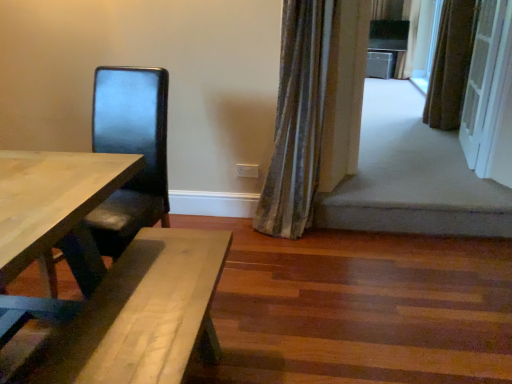
Question: Is striped fabric curtain at upper right, placed as the third curtain when sorted from bottom to top, far from white textured screen door at upper right?

Choices:
 (A) no
 (B) yes

Answer: (B)

Question: Is the depth of striped fabric curtain at upper right, which appears as the first curtain when viewed from the top, greater than that of white textured screen door at upper right?

Choices:
 (A) yes
 (B) no

Answer: (A)

Question: Does striped fabric curtain at upper right, the 3th curtain from the left, have a lesser height compared to white textured screen door at upper right?

Choices:
 (A) no
 (B) yes

Answer: (A)

Question: Considering the relative positions of striped fabric curtain at upper right, the 3th curtain when ordered from front to back, and white textured screen door at upper right in the image provided, is striped fabric curtain at upper right, the 3th curtain when ordered from front to back, to the left of white textured screen door at upper right from the viewer's perspective?

Choices:
 (A) no
 (B) yes

Answer: (A)

Question: Considering the relative sizes of striped fabric curtain at upper right, the 3th curtain from the left, and white textured screen door at upper right in the image provided, is striped fabric curtain at upper right, the 3th curtain from the left, bigger than white textured screen door at upper right?

Choices:
 (A) yes
 (B) no

Answer: (B)

Question: Visually, is white textured screen door at upper right positioned to the left or to the right of matte black chair at left?

Choices:
 (A) left
 (B) right

Answer: (B)

Question: From their relative heights in the image, would you say white textured screen door at upper right is taller or shorter than matte black chair at left?

Choices:
 (A) tall
 (B) short

Answer: (A)

Question: Considering the positions of point (459, 139) and point (92, 235), is point (459, 139) closer or farther from the camera than point (92, 235)?

Choices:
 (A) closer
 (B) farther

Answer: (B)

Question: Is white textured screen door at upper right in front of or behind matte black chair at left in the image?

Choices:
 (A) front
 (B) behind

Answer: (B)

Question: Looking at their shapes, would you say white textured screen door at upper right is wider or thinner than velvet-like curtain at upper right, which ranks as the third curtain in top-to-bottom order?

Choices:
 (A) wide
 (B) thin

Answer: (B)

Question: From a real-world perspective, is white textured screen door at upper right above or below velvet-like curtain at upper right, the third curtain viewed from the back?

Choices:
 (A) below
 (B) above

Answer: (B)

Question: From their relative heights in the image, would you say white textured screen door at upper right is taller or shorter than velvet-like curtain at upper right, the 1th curtain viewed from the left?

Choices:
 (A) tall
 (B) short

Answer: (B)

Question: From the image's perspective, is white textured screen door at upper right positioned above or below velvet-like curtain at upper right, acting as the 1th curtain starting from the bottom?

Choices:
 (A) above
 (B) below

Answer: (A)

Question: From their relative heights in the image, would you say velvet-like curtain at upper right, which ranks as the third curtain in top-to-bottom order, is taller or shorter than matte black chair at left?

Choices:
 (A) tall
 (B) short

Answer: (A)

Question: From the image's perspective, is velvet-like curtain at upper right, the 1th curtain viewed from the front, positioned above or below matte black chair at left?

Choices:
 (A) below
 (B) above

Answer: (B)